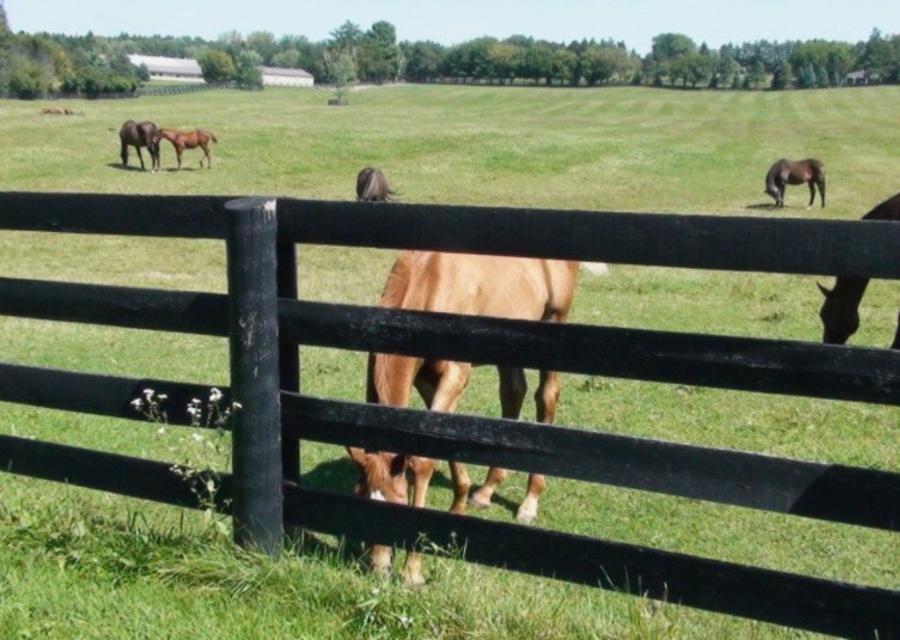
Is black wood fence at center behind light brown horse at center?

No, black wood fence at center is closer to the viewer.

Can you confirm if black wood fence at center is smaller than light brown horse at center?

No.

Measure the distance between point (x=848, y=243) and camera.

They are 6.65 feet apart.

You are a GUI agent. You are given a task and a screenshot of the screen. Output one action in this format:
    pyautogui.click(x=<x>, y=<y>)
    Task: Click on the black wood fence at center
    
    Given the screenshot: What is the action you would take?
    pyautogui.click(x=504, y=362)

Who is lower down, dark brown glossy horse at right or brown glossy horse at upper center?

brown glossy horse at upper center is below.

Who is more forward, (x=801, y=179) or (x=369, y=193)?

Point (x=369, y=193) is in front.

This screenshot has height=640, width=900. Describe the element at coordinates (794, 179) in the screenshot. I see `dark brown glossy horse at right` at that location.

Locate an element on the screen. Image resolution: width=900 pixels, height=640 pixels. dark brown glossy horse at right is located at coordinates (794, 179).

Who is taller, brown glossy horse at center or dark brown glossy horse at right?

brown glossy horse at center is taller.

Is brown glossy horse at center thinner than dark brown glossy horse at right?

Yes, brown glossy horse at center is thinner than dark brown glossy horse at right.

Is point (420, 397) behind point (789, 180)?

No, (420, 397) is closer to viewer.

Where is `brown glossy horse at center`? The width and height of the screenshot is (900, 640). brown glossy horse at center is located at coordinates (480, 284).